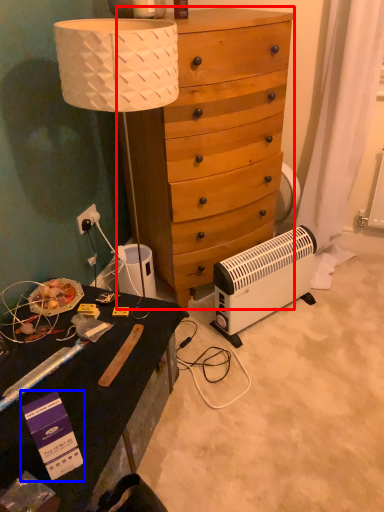
Question: Which object appears closest to the camera in this image, dresser (highlighted by a red box) or box (highlighted by a blue box)?

Choices:
 (A) dresser
 (B) box

Answer: (B)